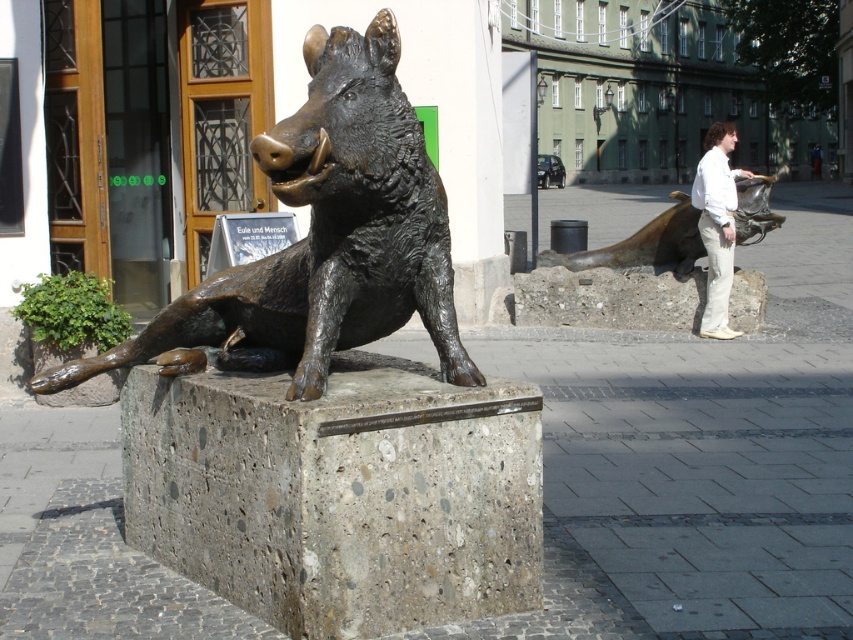
Based on the photo, you are a painter standing at the position of the white cotton pants at right, wanting to paint the bronze statue of a boar at center. Given that your longest brush is 7 meters, can you reach the statue with your brush?

The bronze statue of a boar at center is 6.92 meters from white cotton pants at right. Since the distance is less than 7 meters, you can reach the statue with your longest brush.

You are an artist planning to sketch the bronze statue at right and the white cotton pants at right. Since you want to ensure proper proportions, which object should you draw first to establish the smaller size?

The bronze statue at right has a lesser width compared to the white cotton pants at right, so you should draw the bronze statue at right first to establish the smaller size.